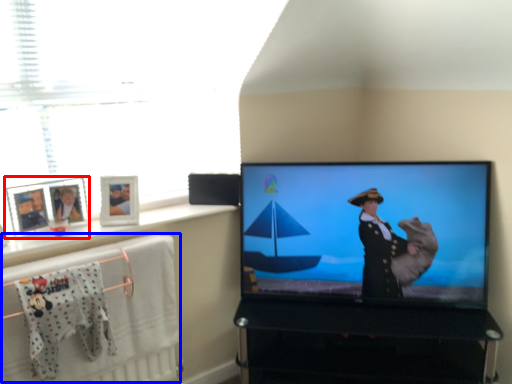
Question: Which of the following is the farthest to the observer, picture frame (highlighted by a red box) or bath towel (highlighted by a blue box)?

Choices:
 (A) picture frame
 (B) bath towel

Answer: (A)